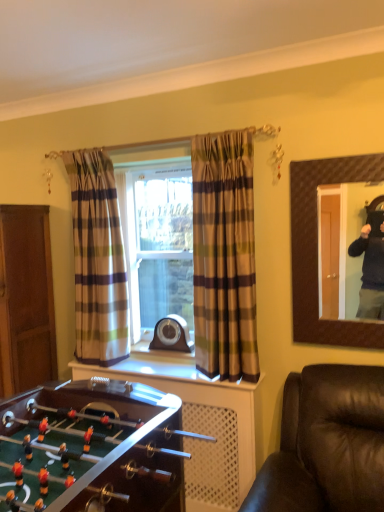
In order to click on free point below brown plaid curtain at center, the 2th curtain positioned from the back (from a real-world perspective) in this screenshot , I will do (222, 379).